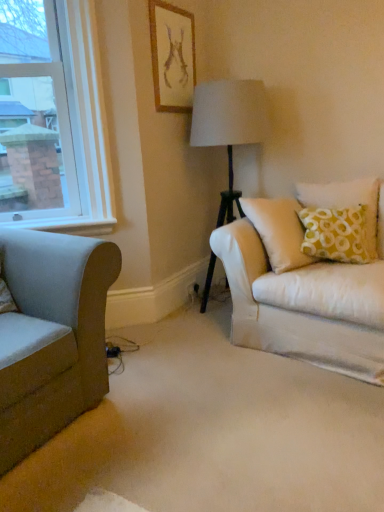
Question: From a real-world perspective, does beige fabric carpet at center stand above velvet green couch at left?

Choices:
 (A) no
 (B) yes

Answer: (A)

Question: Is beige fabric carpet at center shorter than velvet green couch at left?

Choices:
 (A) yes
 (B) no

Answer: (A)

Question: Does beige fabric carpet at center have a lesser width compared to velvet green couch at left?

Choices:
 (A) no
 (B) yes

Answer: (A)

Question: Is beige fabric carpet at center taller than velvet green couch at left?

Choices:
 (A) yes
 (B) no

Answer: (B)

Question: Is beige fabric carpet at center aimed at velvet green couch at left?

Choices:
 (A) no
 (B) yes

Answer: (A)

Question: From the image's perspective, is beige fabric carpet at center on top of velvet green couch at left?

Choices:
 (A) no
 (B) yes

Answer: (A)

Question: Can you confirm if velvet green couch at left is taller than matte gold picture frame at upper center?

Choices:
 (A) no
 (B) yes

Answer: (B)

Question: Is matte gold picture frame at upper center at the back of velvet green couch at left?

Choices:
 (A) no
 (B) yes

Answer: (A)

Question: Is velvet green couch at left at the left side of matte gold picture frame at upper center?

Choices:
 (A) no
 (B) yes

Answer: (B)

Question: Is matte gold picture frame at upper center surrounded by velvet green couch at left?

Choices:
 (A) no
 (B) yes

Answer: (A)

Question: From the image's perspective, does velvet green couch at left appear higher than matte gold picture frame at upper center?

Choices:
 (A) yes
 (B) no

Answer: (B)

Question: From the image's perspective, is velvet green couch at left located beneath matte gold picture frame at upper center?

Choices:
 (A) no
 (B) yes

Answer: (B)

Question: Is beige fabric carpet at center facing towards white glass window at upper left?

Choices:
 (A) no
 (B) yes

Answer: (A)